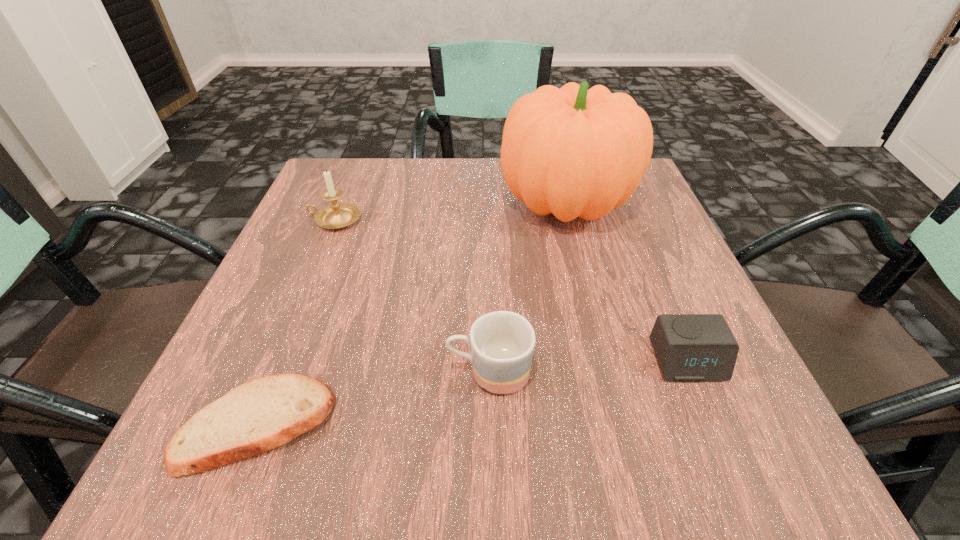
Find the location of a particular element. vacant region that satisfies the following two spatial constraints: 1. on the front-facing side of the alarm clock; 2. on the side with the handle of the mug is located at coordinates (692, 372).

In order to click on vacant position in the image that satisfies the following two spatial constraints: 1. on the front-facing side of the alarm clock; 2. on the side with the handle of the third tallest object in this screenshot , I will do `click(692, 372)`.

Where is `free space that satisfies the following two spatial constraints: 1. on the front side of the pumpkin; 2. with a handle on the side of the fourth shortest object`? free space that satisfies the following two spatial constraints: 1. on the front side of the pumpkin; 2. with a handle on the side of the fourth shortest object is located at coordinates (569, 220).

You are a GUI agent. You are given a task and a screenshot of the screen. Output one action in this format:
    pyautogui.click(x=<x>, y=<y>)
    Task: Click on the vacant space that satisfies the following two spatial constraints: 1. with a handle on the side of the shortest object; 2. on the left side of the second tallest object
    This screenshot has height=540, width=960.
    Given the screenshot: What is the action you would take?
    pyautogui.click(x=251, y=424)